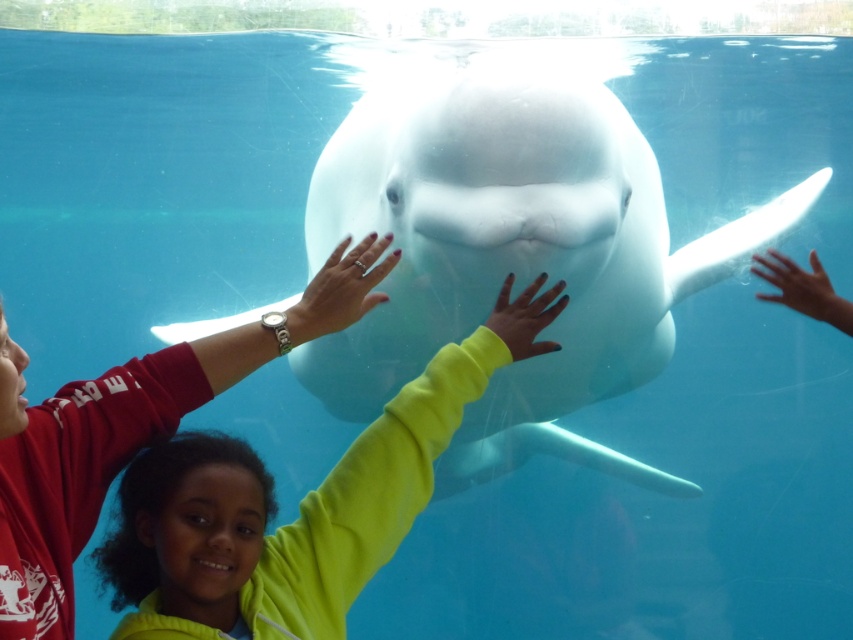
Who is more forward, (x=393, y=116) or (x=149, y=529)?

Point (x=149, y=529)

Based on the photo, can you confirm if white smooth whale at center is bigger than neon yellow sweater at center?

Yes, white smooth whale at center is bigger than neon yellow sweater at center.

Does point (735, 224) come closer to viewer compared to point (387, 448)?

No, it is not.

The height and width of the screenshot is (640, 853). I want to click on white smooth whale at center, so click(x=514, y=252).